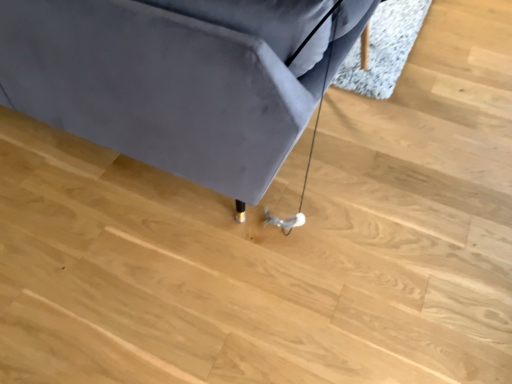
In order to face velvet grey sofa at lower center, should I rotate leftwards or rightwards?

Turn left by 19.473 degrees to look at velvet grey sofa at lower center.

Locate an element on the screen. velvet grey sofa at lower center is located at coordinates 165,86.

The height and width of the screenshot is (384, 512). What do you see at coordinates (165, 86) in the screenshot? I see `velvet grey sofa at lower center` at bounding box center [165, 86].

The image size is (512, 384). I want to click on velvet grey sofa at lower center, so click(x=165, y=86).